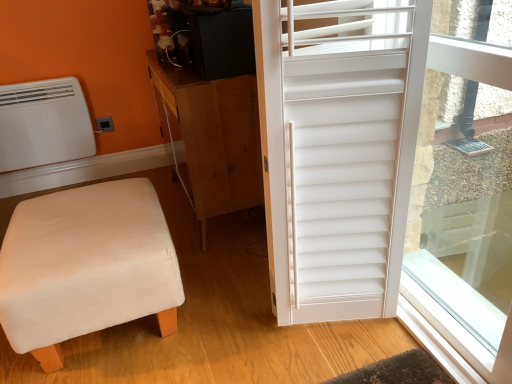
The image size is (512, 384). Describe the element at coordinates (86, 266) in the screenshot. I see `beige fabric stool at lower left` at that location.

Locate an element on the screen. white matte shutter at right is located at coordinates (339, 150).

The height and width of the screenshot is (384, 512). Identify the location of white matte air conditioner at upper left. (44, 124).

The height and width of the screenshot is (384, 512). Find the location of `white matte window screen at right`. white matte window screen at right is located at coordinates (463, 197).

Is the position of brown wood cabinet at center more distant than that of beige fabric stool at lower left?

Yes, the depth of brown wood cabinet at center is greater than that of beige fabric stool at lower left.

From the image's perspective, does brown wood cabinet at center appear lower than beige fabric stool at lower left?

Actually, brown wood cabinet at center appears above beige fabric stool at lower left in the image.

Does brown wood cabinet at center have a greater width compared to beige fabric stool at lower left?

Incorrect, the width of brown wood cabinet at center does not surpass that of beige fabric stool at lower left.

Consider the image. What's the angular difference between brown wood cabinet at center and beige fabric stool at lower left's facing directions?

The angular difference between brown wood cabinet at center and beige fabric stool at lower left is 0.258 degrees.

Is beige fabric stool at lower left not close to brown wood cabinet at center?

They are positioned close to each other.

Which object is positioned more to the right, beige fabric stool at lower left or brown wood cabinet at center?

brown wood cabinet at center is more to the right.

Considering their positions, is beige fabric stool at lower left located in front of or behind brown wood cabinet at center?

Visually, beige fabric stool at lower left is located in front of brown wood cabinet at center.

Can you confirm if beige fabric stool at lower left is thinner than brown wood cabinet at center?

No.

Looking at this image, could you tell me if white matte air conditioner at upper left is facing white matte shutter at right?

Yes, white matte air conditioner at upper left is facing white matte shutter at right.

Is point (90, 151) farther from viewer compared to point (377, 310)?

Yes, it is.

Looking at the image, does white matte air conditioner at upper left seem bigger or smaller compared to white matte shutter at right?

white matte air conditioner at upper left is smaller than white matte shutter at right.

Does white matte air conditioner at upper left lie in front of white matte shutter at right?

No, it is behind white matte shutter at right.

From the image's perspective, between white matte shutter at right and white matte window screen at right, which one is located above?

white matte window screen at right is shown above in the image.

Can you confirm if white matte shutter at right is bigger than white matte window screen at right?

Correct, white matte shutter at right is larger in size than white matte window screen at right.

From a real-world perspective, between white matte shutter at right and white matte window screen at right, who is vertically lower?

white matte window screen at right.

Measure the distance between white matte shutter at right and brown wood cabinet at center.

white matte shutter at right and brown wood cabinet at center are 52.15 centimeters apart.

Which object is positioned more to the right, white matte shutter at right or brown wood cabinet at center?

white matte shutter at right is more to the right.

Could you tell me if white matte shutter at right is facing brown wood cabinet at center?

No, white matte shutter at right is not turned towards brown wood cabinet at center.

From their relative heights in the image, would you say white matte shutter at right is taller or shorter than brown wood cabinet at center?

Clearly, white matte shutter at right is taller compared to brown wood cabinet at center.

Looking at this image, which is behind, white matte air conditioner at upper left or brown wood cabinet at center?

white matte air conditioner at upper left is further away from the camera.

Which of these two, white matte air conditioner at upper left or brown wood cabinet at center, stands shorter?

Standing shorter between the two is white matte air conditioner at upper left.

Can you confirm if white matte air conditioner at upper left is wider than brown wood cabinet at center?

In fact, white matte air conditioner at upper left might be narrower than brown wood cabinet at center.

Is point (79, 105) closer to viewer compared to point (219, 161)?

No, (79, 105) is behind (219, 161).

From a real-world perspective, is beige fabric stool at lower left physically below white matte air conditioner at upper left?

Correct, in the physical world, beige fabric stool at lower left is lower than white matte air conditioner at upper left.

Is beige fabric stool at lower left in contact with white matte air conditioner at upper left?

There is a gap between beige fabric stool at lower left and white matte air conditioner at upper left.

Measure the distance from beige fabric stool at lower left to white matte air conditioner at upper left.

They are 3.48 feet apart.

Is beige fabric stool at lower left closer to camera compared to white matte air conditioner at upper left?

Yes, it is in front of white matte air conditioner at upper left.

The height and width of the screenshot is (384, 512). Find the location of `cabinetry above the beige fabric stool at lower left (from a real-world perspective)`. cabinetry above the beige fabric stool at lower left (from a real-world perspective) is located at coordinates (210, 138).

In the image, there is a brown wood cabinet at center. At what (x,y) coordinates should I click in order to perform the action: click on furniture below it (from the image's perspective). Please return your answer as a coordinate pair (x, y). The image size is (512, 384). Looking at the image, I should click on (86, 266).

Looking at the image, which one is located further to white matte air conditioner at upper left, white matte shutter at right or white matte window screen at right?

white matte window screen at right is further to white matte air conditioner at upper left.

Considering their positions, is white matte window screen at right positioned further to white matte air conditioner at upper left than beige fabric stool at lower left?

white matte window screen at right lies further to white matte air conditioner at upper left than the other object.

Estimate the real-world distances between objects in this image. Which object is further from white matte window screen at right, beige fabric stool at lower left or brown wood cabinet at center?

Among the two, beige fabric stool at lower left is located further to white matte window screen at right.

Estimate the real-world distances between objects in this image. Which object is further from brown wood cabinet at center, beige fabric stool at lower left or white matte air conditioner at upper left?

The object further to brown wood cabinet at center is white matte air conditioner at upper left.

Based on their spatial positions, is white matte window screen at right or white matte air conditioner at upper left further from white matte shutter at right?

white matte air conditioner at upper left is positioned further to the anchor white matte shutter at right.

When comparing their distances from beige fabric stool at lower left, does white matte shutter at right or brown wood cabinet at center seem closer?

brown wood cabinet at center.

Considering their positions, is white matte air conditioner at upper left positioned closer to brown wood cabinet at center than beige fabric stool at lower left?

beige fabric stool at lower left is positioned closer to the anchor brown wood cabinet at center.

From the image, which object appears to be nearer to white matte shutter at right, beige fabric stool at lower left or white matte window screen at right?

Among the two, white matte window screen at right is located nearer to white matte shutter at right.

Image resolution: width=512 pixels, height=384 pixels. In order to click on cabinetry positioned between beige fabric stool at lower left and white matte air conditioner at upper left from near to far in this screenshot , I will do [210, 138].

Find the location of a particular element. cabinetry located between white matte air conditioner at upper left and white matte shutter at right in the left-right direction is located at coordinates (210, 138).

This screenshot has width=512, height=384. I want to click on door located between brown wood cabinet at center and white matte window screen at right in the left-right direction, so click(339, 150).

Where is `door located between beige fabric stool at lower left and white matte window screen at right in the left-right direction`? This screenshot has width=512, height=384. door located between beige fabric stool at lower left and white matte window screen at right in the left-right direction is located at coordinates (339, 150).